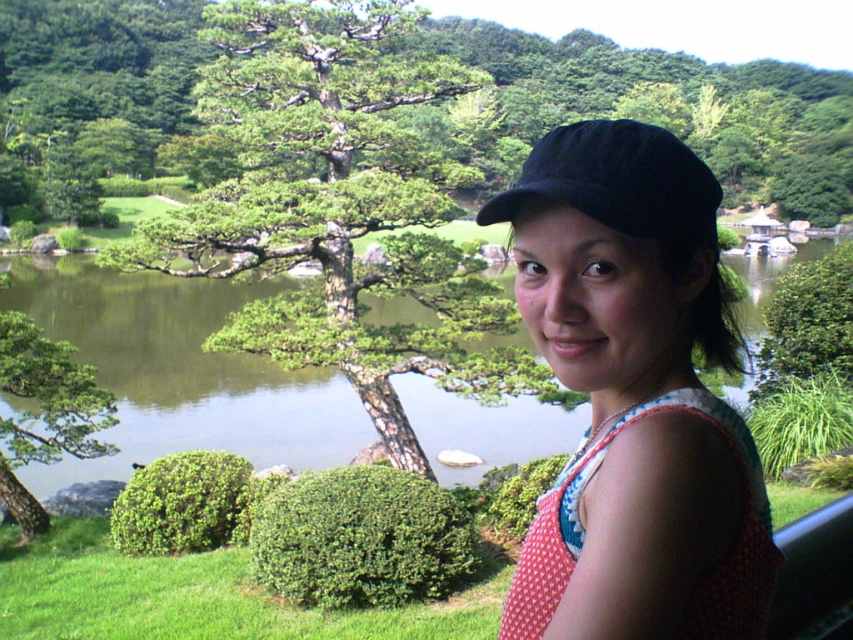
You are a photographer wanting to capture the entire view of the green liquid water at center and the black fabric baseball cap at upper center in one shot. Which object would require you to adjust your camera angle to include its full width in the frame?

The green liquid water at center has a larger width than the black fabric baseball cap at upper center, so you would need to adjust your camera angle to include its full width in the frame.